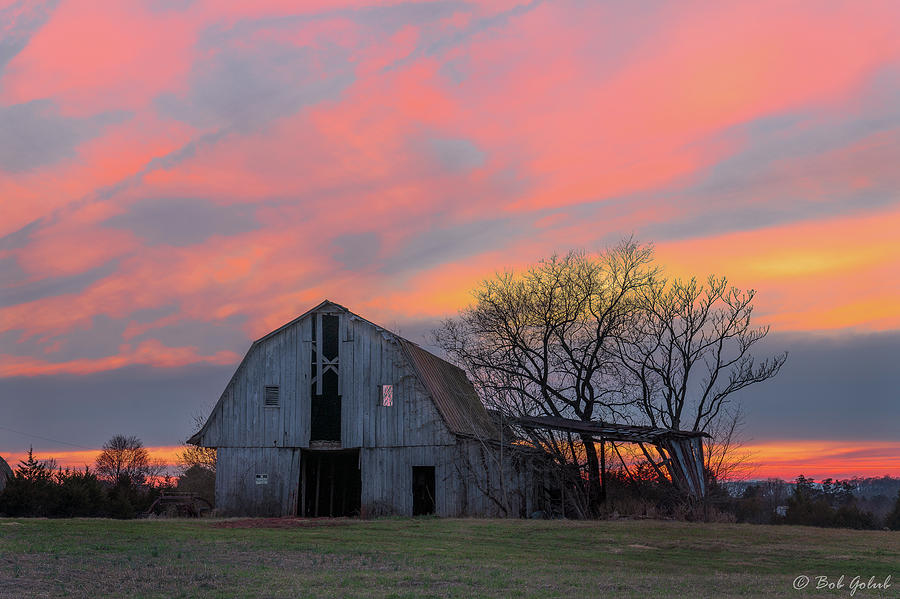
Find the location of a particular element. The image size is (900, 599). window is located at coordinates (271, 396).